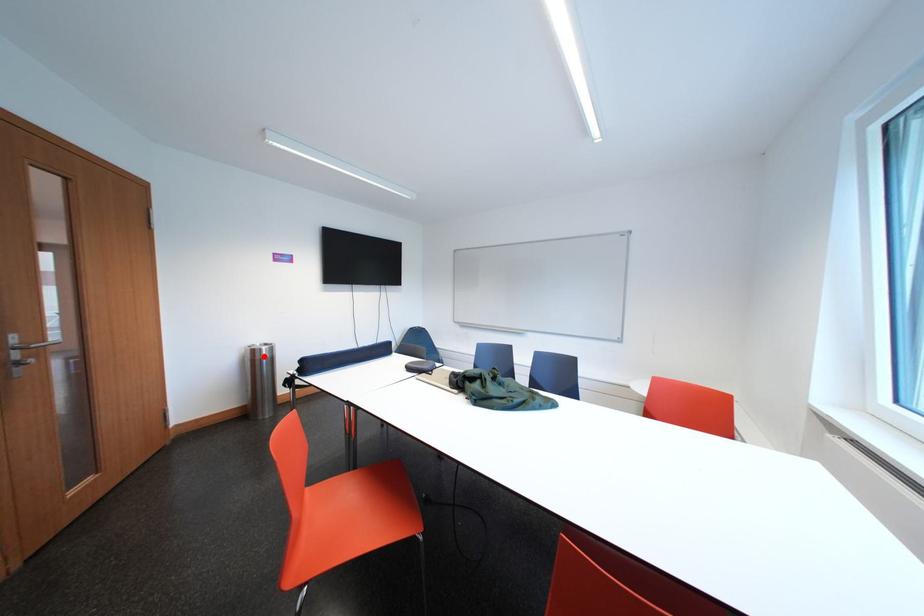
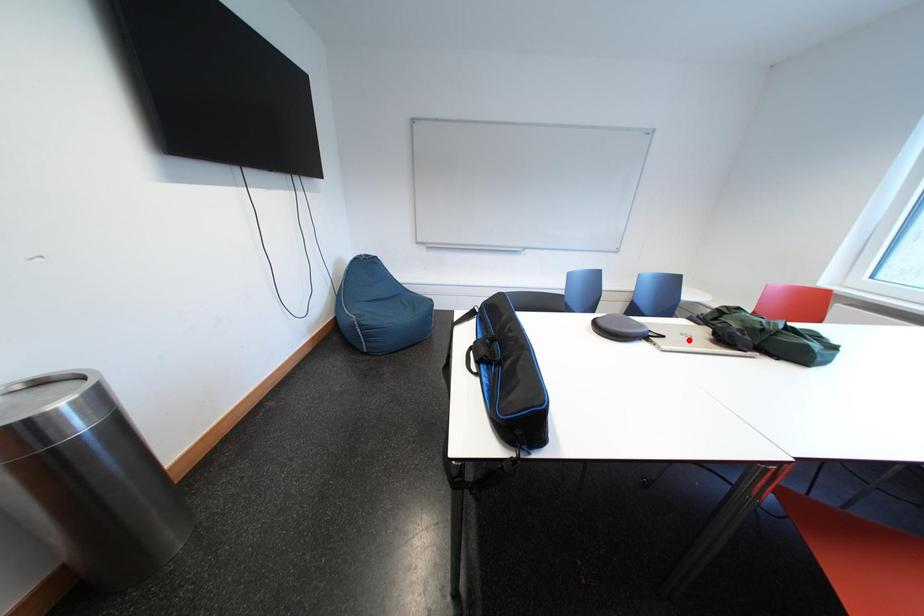
I am providing you with two images of the same scene from different viewpoints. A red point is marked on the first image and another point is marked on the second image. Is the marked point in image1 the same physical position as the marked point in image2?

No